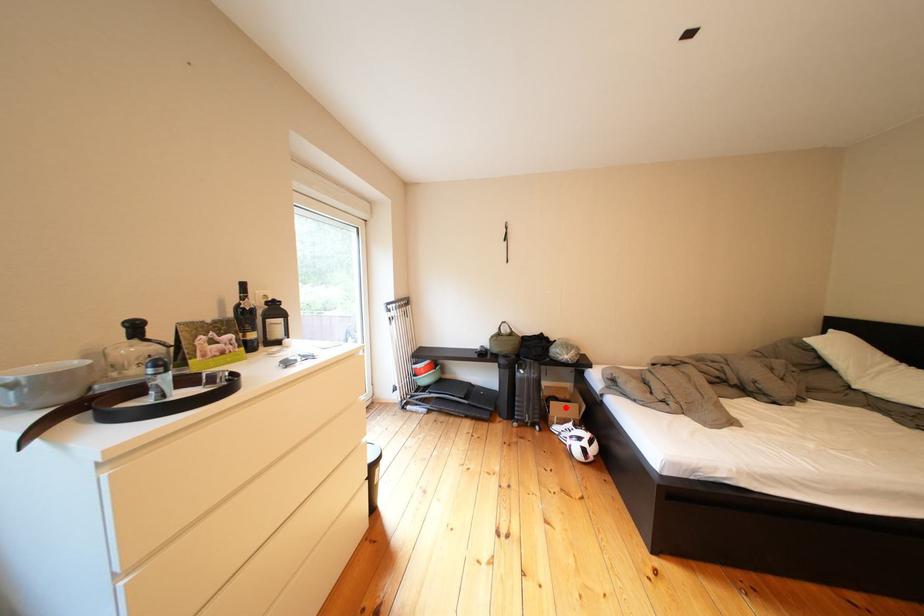
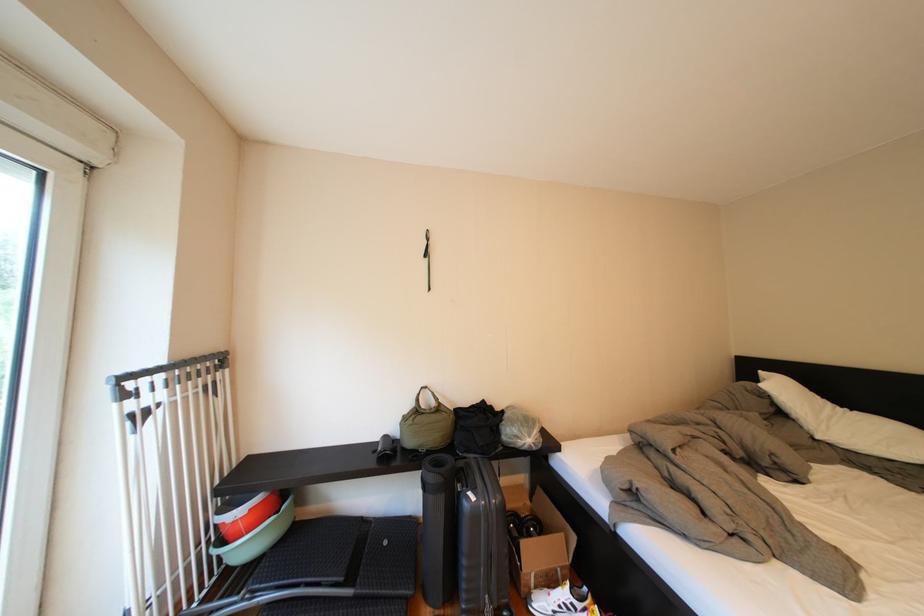
Question: I am providing you with two images of the same scene from different viewpoints. A red point is marked on the first image. Is the red point's position out of view in image 2?

Choices:
 (A) Yes
 (B) No

Answer: (B)